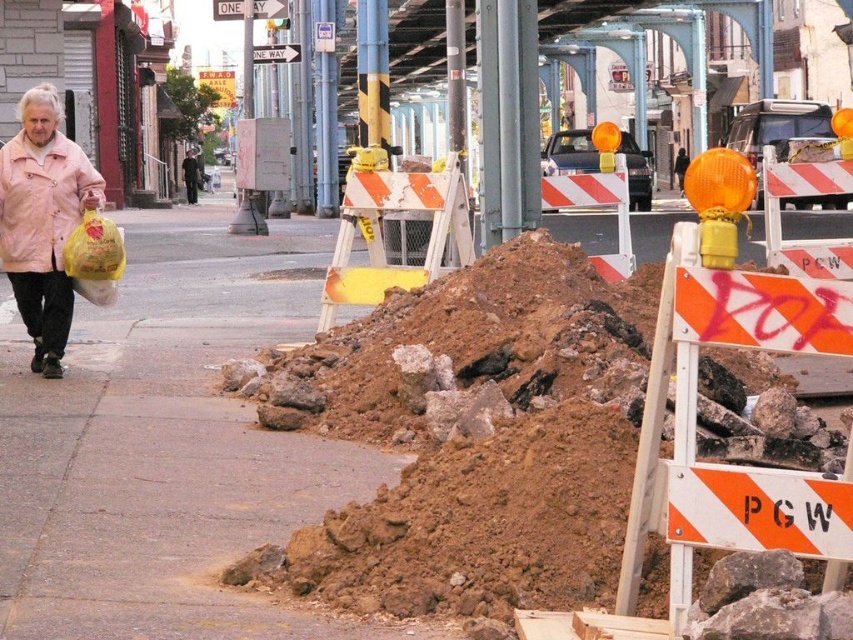
You are a pedestrian on the sidewalk and see both the pink matte jacket at left and the matte pink jacket at left. Which one is more to the left?

The pink matte jacket at left is more to the left.